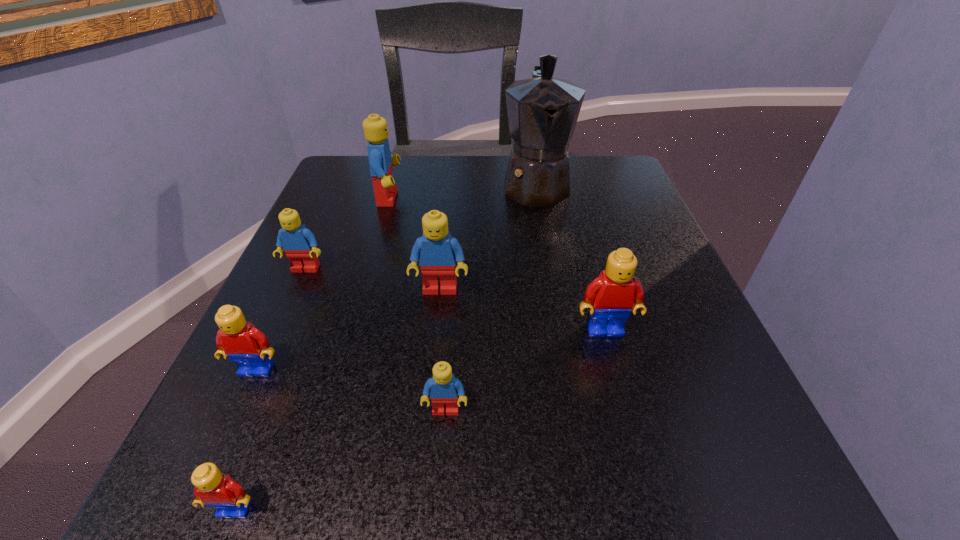
At what (x,y) coordinates should I click in order to perform the action: click on blank area located on the front-facing side of the second farthest yellow Lego. Please return your answer as a coordinate pair (x, y). Image resolution: width=960 pixels, height=540 pixels. Looking at the image, I should click on (222, 448).

This screenshot has height=540, width=960. Identify the location of free space located 0.110m on the face of the smallest blue Lego. click(x=439, y=512).

Image resolution: width=960 pixels, height=540 pixels. I want to click on coffeepot that is at the far edge, so click(x=542, y=111).

Locate an element on the screen. This screenshot has height=540, width=960. Lego that is at the far edge is located at coordinates (375, 128).

Locate an element on the screen. object located at the near edge is located at coordinates (212, 488).

Identify the location of coffeepot situated at the right edge. (542, 111).

Where is `Lego located in the right edge section of the desktop`? The height and width of the screenshot is (540, 960). Lego located in the right edge section of the desktop is located at coordinates (610, 297).

Find the location of a particular element. The image size is (960, 540). object at the far left corner is located at coordinates (375, 128).

Locate an element on the screen. Image resolution: width=960 pixels, height=540 pixels. object that is at the near left corner is located at coordinates (212, 488).

At what (x,y) coordinates should I click in order to perform the action: click on object located at the far right corner. Please return your answer as a coordinate pair (x, y). This screenshot has height=540, width=960. Looking at the image, I should click on (542, 111).